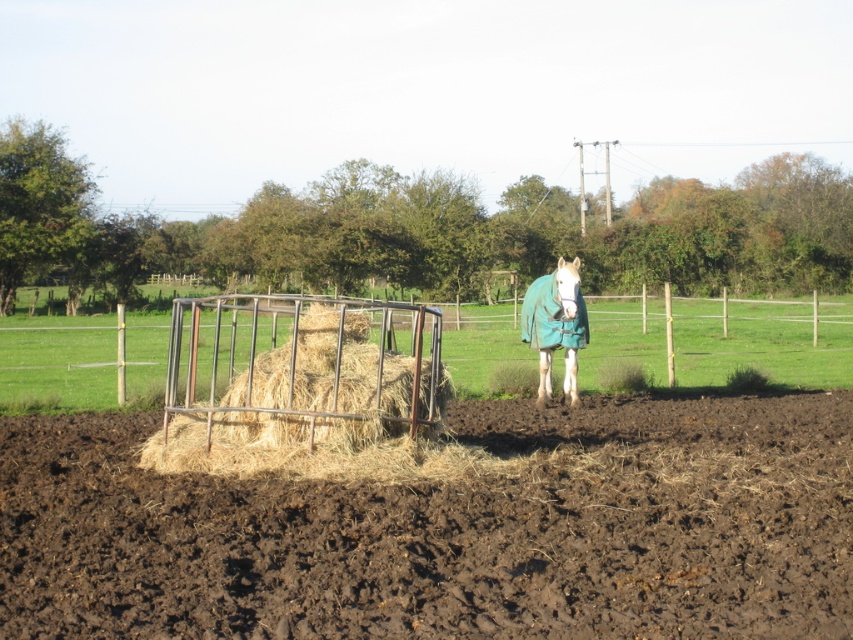
How distant is brown soil at lower center from white fleece horse at center?

brown soil at lower center is 19.07 feet away from white fleece horse at center.

Between brown soil at lower center and white fleece horse at center, which one is positioned higher?

white fleece horse at center

Describe the element at coordinates (448, 531) in the screenshot. I see `brown soil at lower center` at that location.

Identify the location of brown soil at lower center. (448, 531).

Does light brown straw at center have a smaller size compared to white fleece horse at center?

Actually, light brown straw at center might be larger than white fleece horse at center.

Between light brown straw at center and white fleece horse at center, which one has less height?

Standing shorter between the two is white fleece horse at center.

Is point (380, 449) less distant than point (550, 324)?

Yes, point (380, 449) is in front of point (550, 324).

Find the location of a particular element. light brown straw at center is located at coordinates (303, 392).

Is brown soil at lower center further to the viewer compared to rusty metal hay feeder at center?

No.

Is point (292, 552) positioned before point (491, 368)?

Yes, point (292, 552) is closer to viewer.

At what (x,y) coordinates should I click in order to perform the action: click on brown soil at lower center. Please return your answer as a coordinate pair (x, y). This screenshot has height=640, width=853. Looking at the image, I should click on (448, 531).